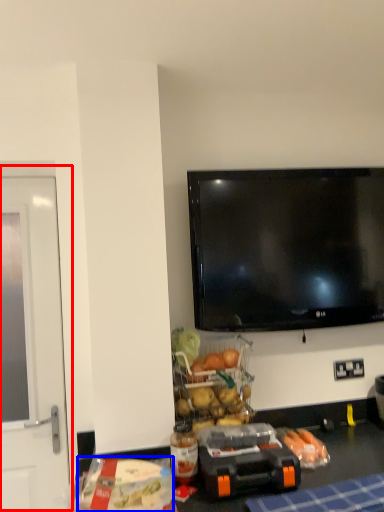
Question: Among these objects, which one is nearest to the camera, screen door (highlighted by a red box) or food (highlighted by a blue box)?

Choices:
 (A) screen door
 (B) food

Answer: (B)